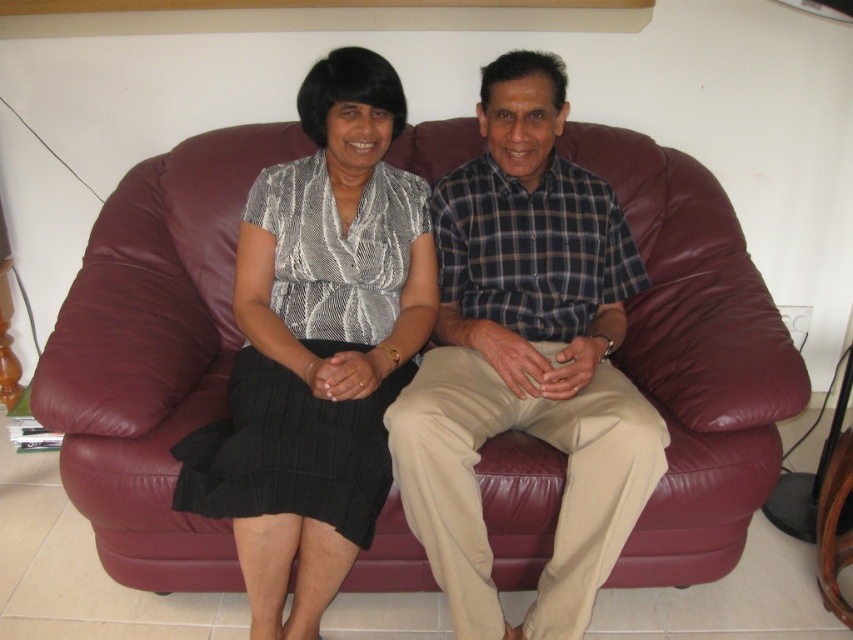
Does plaid cotton shirt at center have a lesser width compared to matte black dress at center?

In fact, plaid cotton shirt at center might be wider than matte black dress at center.

Is point (643, 464) farther from viewer compared to point (433, 257)?

No, (643, 464) is closer to viewer.

Find the location of `plaid cotton shirt at center`. plaid cotton shirt at center is located at coordinates (526, 358).

Looking at this image, does maroon leather couch at center appear on the left side of plaid cotton shirt at center?

No, maroon leather couch at center is not to the left of plaid cotton shirt at center.

Does point (751, 376) come farther from viewer compared to point (576, 304)?

No.

The width and height of the screenshot is (853, 640). Describe the element at coordinates (154, 353) in the screenshot. I see `maroon leather couch at center` at that location.

Where is `maroon leather couch at center`? Image resolution: width=853 pixels, height=640 pixels. maroon leather couch at center is located at coordinates (154, 353).

Is point (144, 176) in front of point (352, 96)?

No, (144, 176) is behind (352, 96).

Which is behind, point (157, 266) or point (343, 556)?

Positioned behind is point (157, 266).

This screenshot has height=640, width=853. Describe the element at coordinates (154, 353) in the screenshot. I see `maroon leather couch at center` at that location.

Identify the location of maroon leather couch at center. (154, 353).